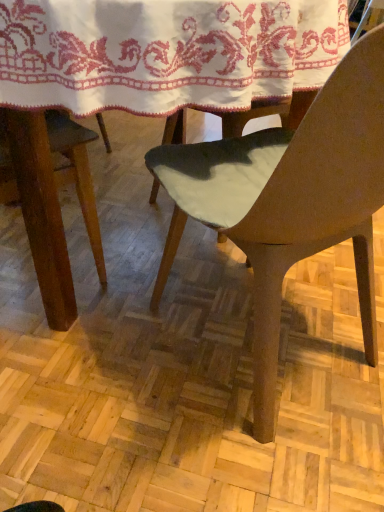
At what (x,y) coordinates should I click in order to perform the action: click on vacant area in front of matte brown chair at center. Please return your answer as a coordinate pair (x, y). This screenshot has height=512, width=384. Looking at the image, I should click on (241, 457).